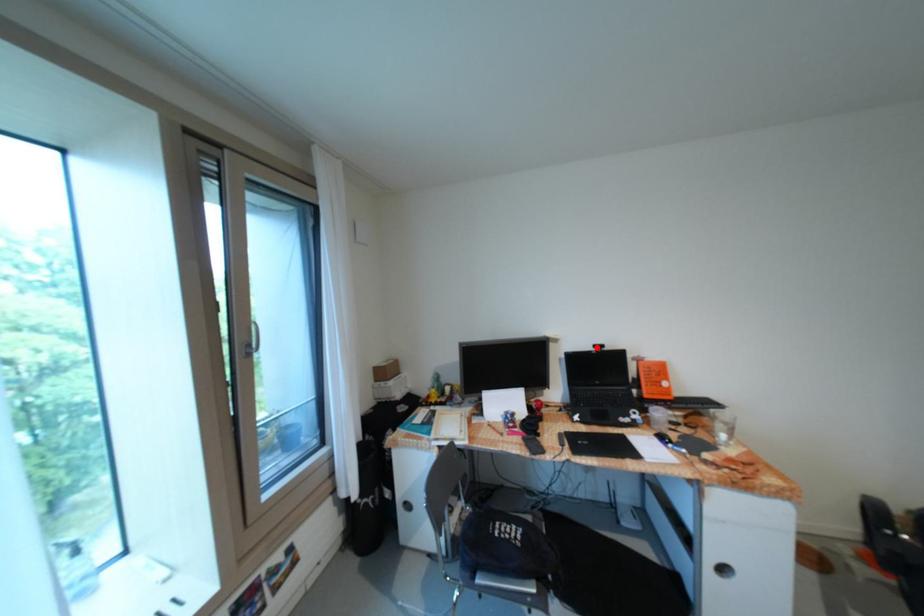
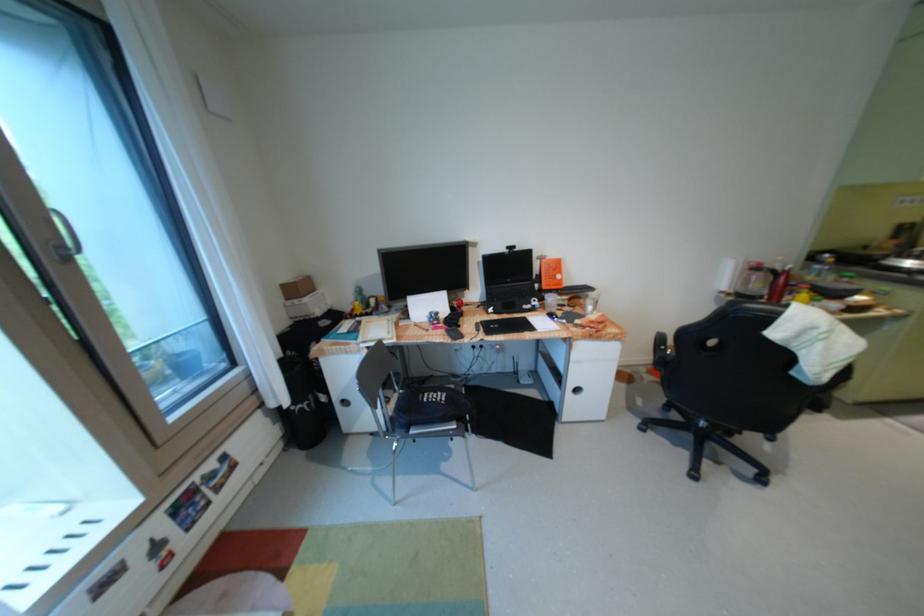
Question: A red point is marked in image1. In image2, is the corresponding 3D point closer to the camera or farther? Reply with the corresponding letter.

Choices:
 (A) The corresponding 3D point is closer.
 (B) The corresponding 3D point is farther.

Answer: (A)